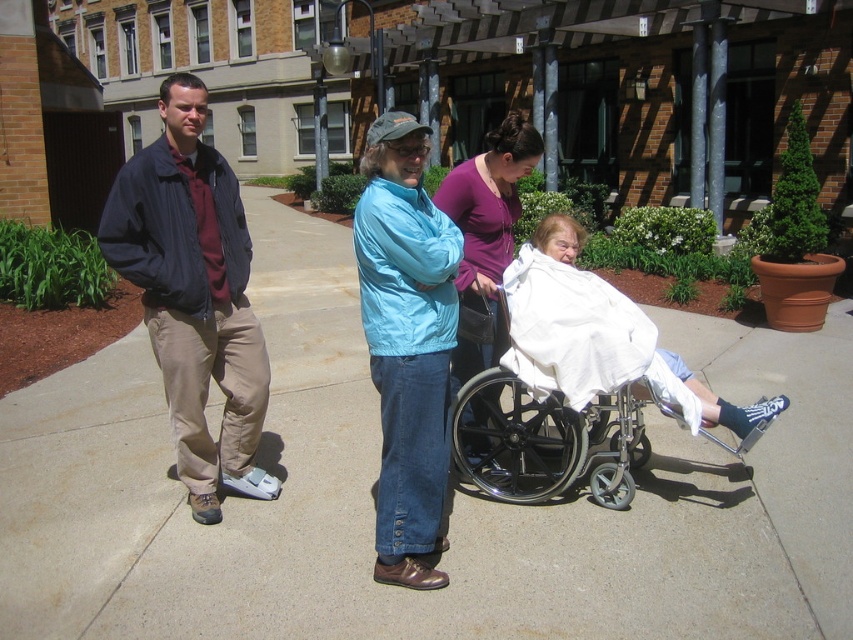
Question: Is matte blue jacket at center wider than metallic silver wheelchair at center?

Choices:
 (A) yes
 (B) no

Answer: (B)

Question: Is light blue nylon jacket at center wider than matte purple shirt at center?

Choices:
 (A) no
 (B) yes

Answer: (A)

Question: Which of these objects is positioned farthest from the light blue nylon jacket at center?

Choices:
 (A) matte blue jacket at center
 (B) metallic silver wheelchair at center

Answer: (A)

Question: Which is nearer to the light blue nylon jacket at center?

Choices:
 (A) matte blue jacket at center
 (B) concrete at center

Answer: (A)

Question: Does concrete at center have a greater width compared to light blue nylon jacket at center?

Choices:
 (A) no
 (B) yes

Answer: (B)

Question: Which of these objects is positioned closest to the matte purple shirt at center?

Choices:
 (A) metallic silver wheelchair at center
 (B) concrete at center
 (C) light blue nylon jacket at center

Answer: (A)